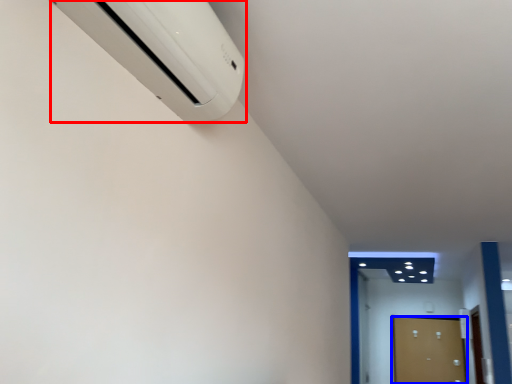
Question: Which object is further to the camera taking this photo, home appliance (highlighted by a red box) or door (highlighted by a blue box)?

Choices:
 (A) home appliance
 (B) door

Answer: (B)